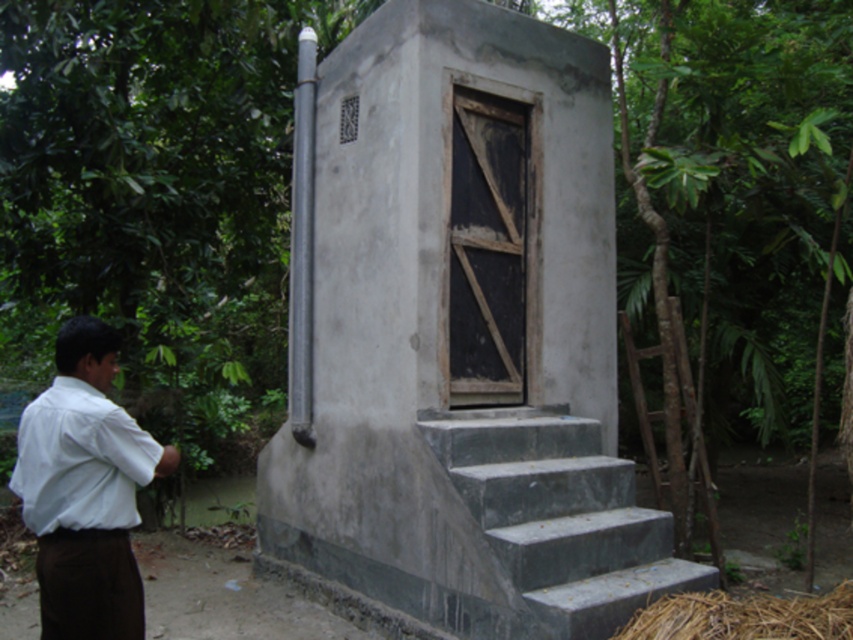
You are standing in front of the gray concrete hut at center and the white matte dress shirt at left. Which object is taller?

The gray concrete hut at center is much taller than the white matte dress shirt at left.

You are standing in front of the toilet structure and want to reach the door. You see the gray concrete stairs at center and the white matte dress shirt at left. Which object is closer to you?

The gray concrete stairs at center are closer to you because they are further to the viewer than the white matte dress shirt at left, meaning they are positioned nearer in the scene.